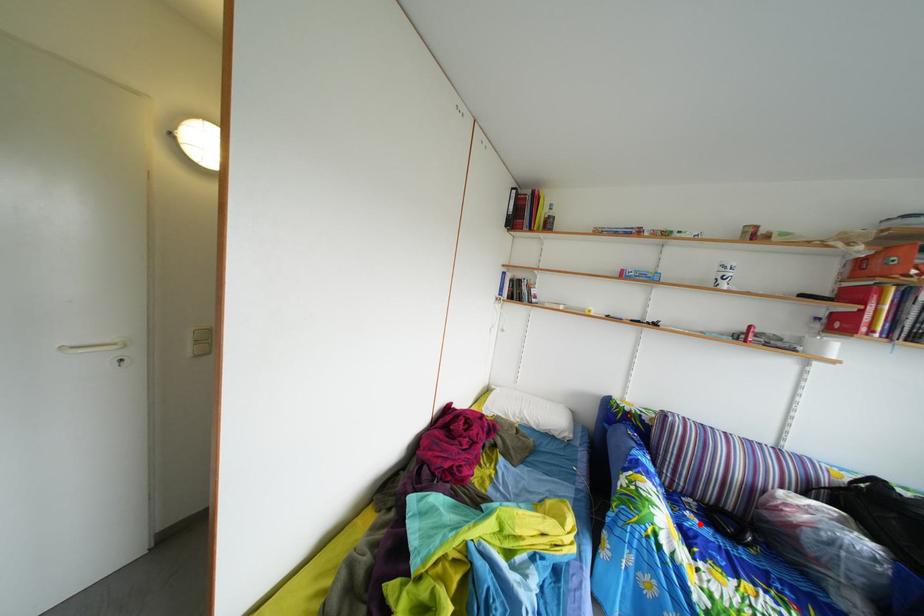
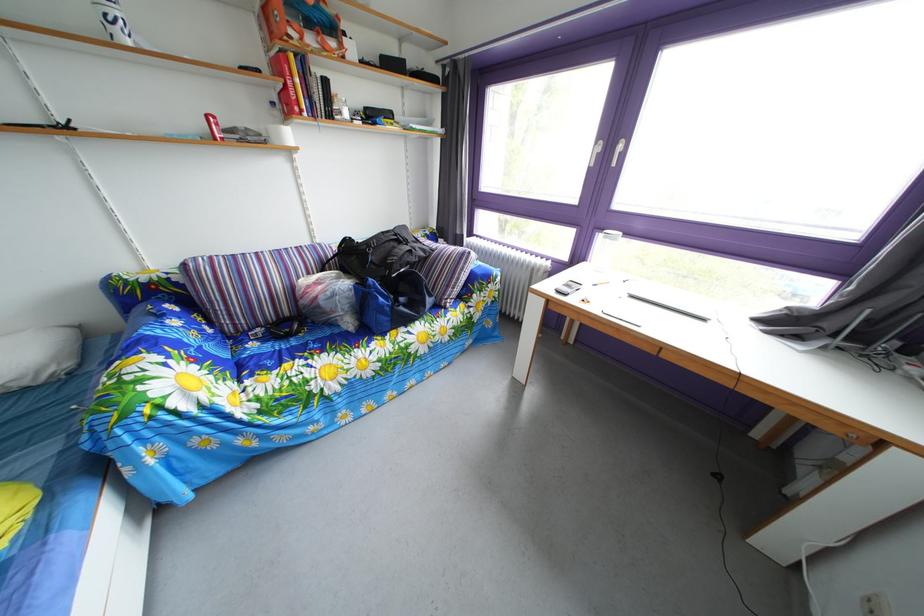
Question: I am providing you with two images of the same scene from different viewpoints. A red point is marked on the first image. Can you still see the location of the red point in image 2?

Choices:
 (A) Yes
 (B) No

Answer: (A)